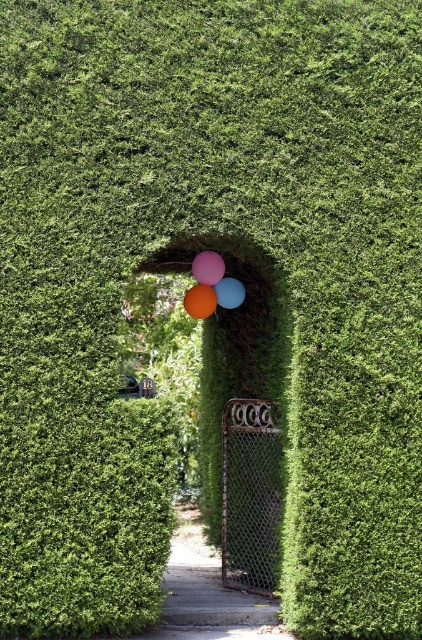
Consider the image. You are planning to walk through the pathway under the hedge archway and want to avoid the balloons. Which direction should you walk to avoid the matte orange balloon at center and the blue glossy balloon at center?

To avoid the matte orange balloon at center and the blue glossy balloon at center, walk to the right side of the pathway since the balloons are positioned at the center of the archway. The matte orange balloon at center is on the left side of the blue glossy balloon at center, so moving right would take you away from both.

You are planning to take a photo of the matte orange balloon at center and the blue glossy balloon at center. To ensure both balloons are in focus, you need to know which one is taller. Which balloon is taller?

The matte orange balloon at center has a greater height compared to the blue glossy balloon at center, so the matte orange balloon at center is taller.

You are planning to hang a small decorative sign between the matte orange balloon at center and the blue glossy balloon at center. Since the sign is 10 cm wide, will it fit between them without overlapping either balloon?

The matte orange balloon at center is smaller than the blue glossy balloon at center, but the exact distance between them isn